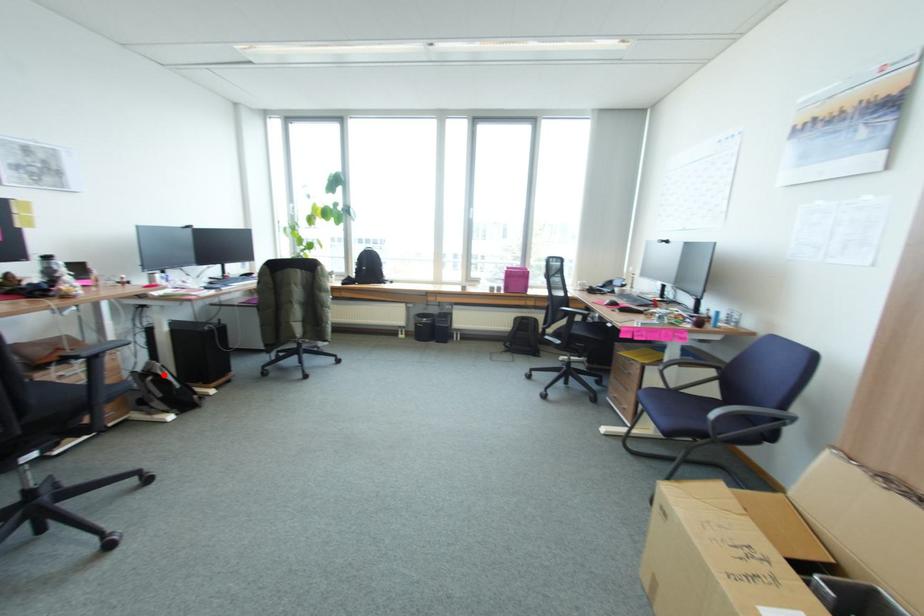
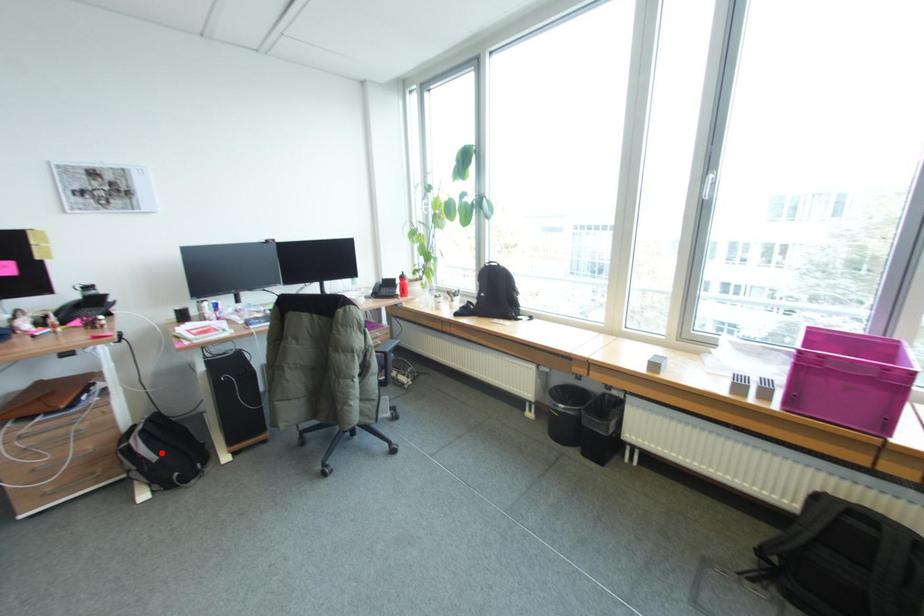
I am providing you with two images of the same scene from different viewpoints. A red point is marked on the first image and another point is marked on the second image. Is the red point in image1 aligned with the point shown in image2?

No